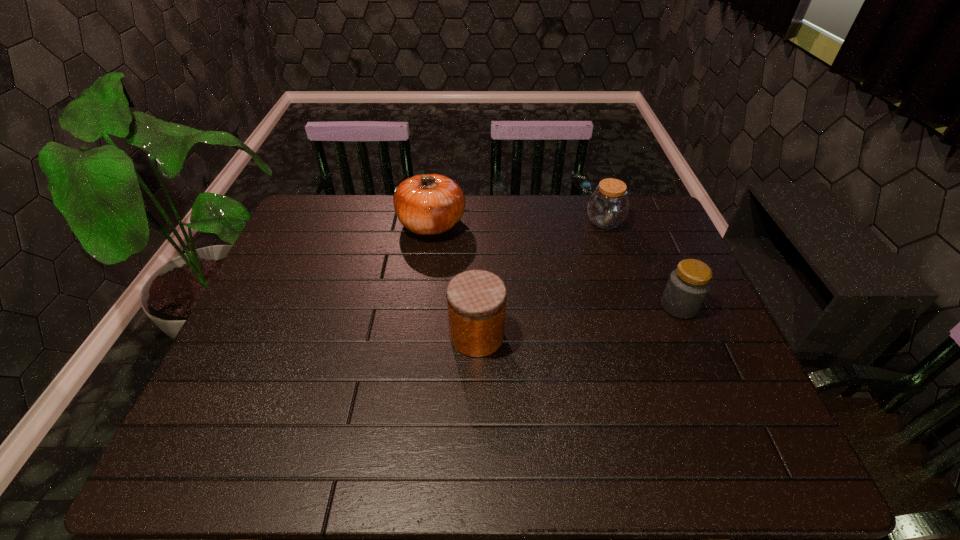
In the image, there is a desktop. Where is `vacant space at the far right corner`? vacant space at the far right corner is located at coordinates (651, 211).

This screenshot has height=540, width=960. Find the location of `free space at the near right corner of the desktop`. free space at the near right corner of the desktop is located at coordinates (739, 471).

Where is `free space between the second jar from left to right and the leftmost jar`? This screenshot has width=960, height=540. free space between the second jar from left to right and the leftmost jar is located at coordinates (540, 279).

This screenshot has width=960, height=540. Identify the location of blank region between the second jar from left to right and the rightmost jar. (641, 264).

Identify the location of free point between the rightmost object and the pumpkin. The height and width of the screenshot is (540, 960). (555, 265).

Identify the location of vacant region between the leftmost jar and the third object from left to right. This screenshot has width=960, height=540. (540, 279).

Identify the location of free space between the pumpkin and the second jar from left to right. [x=518, y=222].

You are a GUI agent. You are given a task and a screenshot of the screen. Output one action in this format:
    pyautogui.click(x=<x>, y=<y>)
    Task: Click on the unoccupied area between the pumpkin and the rightmost jar
    The width and height of the screenshot is (960, 540).
    Given the screenshot: What is the action you would take?
    pyautogui.click(x=555, y=265)

Where is `vacant space that is in between the rightmost jar and the pumpkin`? vacant space that is in between the rightmost jar and the pumpkin is located at coordinates (555, 265).

Identify the location of object that is the third closest to the second jar from right to left. (476, 299).